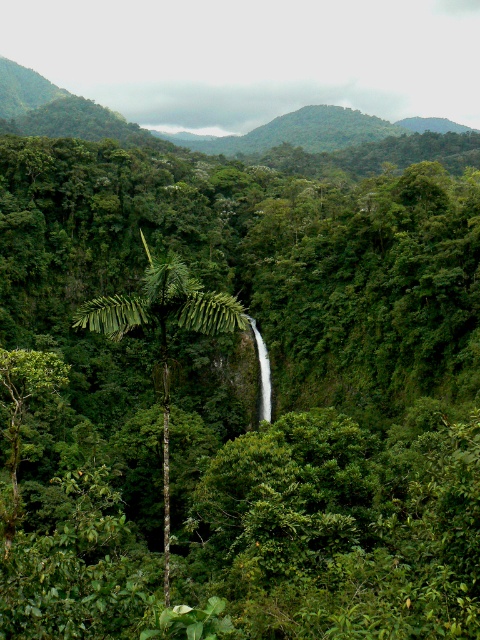
Consider the image. Based on the scene description, which object is wider between the green leafy mountain at upper center and the green leafy palm tree at center?

The green leafy mountain at upper center might be wider than the green leafy palm tree at center according to the description.

You are standing in the lush tropical landscape and want to place a small statue between the two points, point (396, 122) and point (206, 308). Which point should the statue be closer to so it appears in front of the palm tree?

The statue should be placed closer to point (396, 122) because it is closer to the viewer than point (206, 308), so it will appear in front of the palm tree.

You are a hiker standing at the base of the palm tree in the foreground. You want to take a photo of the green leafy mountain at upper center. If your camera can focus on objects up to 400 meters away, will it be able to capture the mountain clearly?

The green leafy mountain at upper center is 372.88 meters away from the camera. Since the camera can focus up to 400 meters, it will be able to capture the mountain clearly.